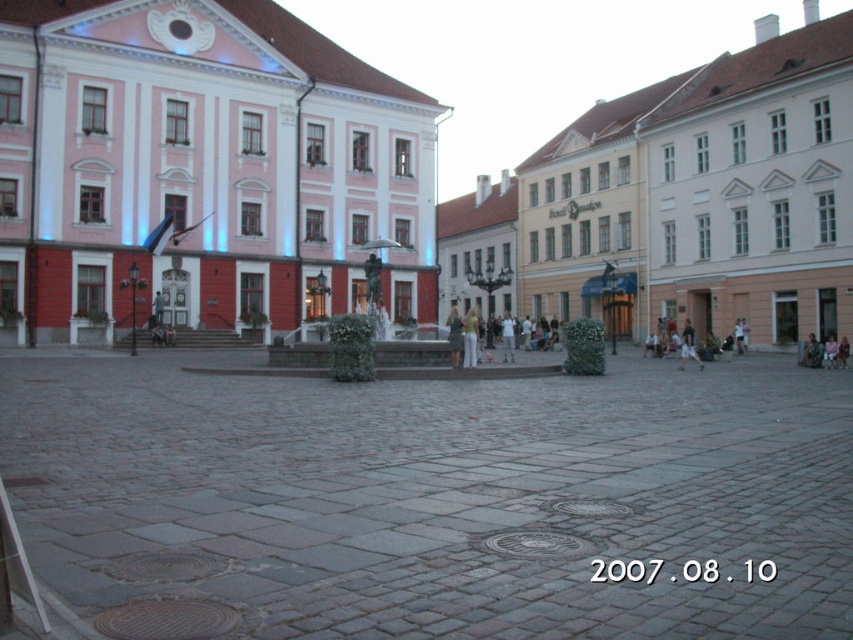
Between point (113, 54) and point (700, 362), which one is positioned behind?

Positioned behind is point (113, 54).

Is point (173, 33) farther from viewer compared to point (689, 346)?

Yes, it is behind point (689, 346).

I want to click on pink stone building at center, so click(x=410, y=179).

Which is below, pink stone building at center or gray stone pavement at center?

gray stone pavement at center is lower down.

Does pink stone building at center have a lesser height compared to gray stone pavement at center?

In fact, pink stone building at center may be taller than gray stone pavement at center.

Is point (428, 205) behind point (547, 563)?

Yes, it is behind point (547, 563).

I want to click on pink stone building at center, so click(x=410, y=179).

Does gray stone pavement at center appear on the right side of white cotton shirt at center?

No, gray stone pavement at center is not to the right of white cotton shirt at center.

Can you confirm if gray stone pavement at center is smaller than white cotton shirt at center?

Correct, gray stone pavement at center occupies less space than white cotton shirt at center.

Is point (608, 547) less distant than point (685, 321)?

Yes, point (608, 547) is closer to viewer.

This screenshot has width=853, height=640. Find the location of `gray stone pavement at center`. gray stone pavement at center is located at coordinates (437, 497).